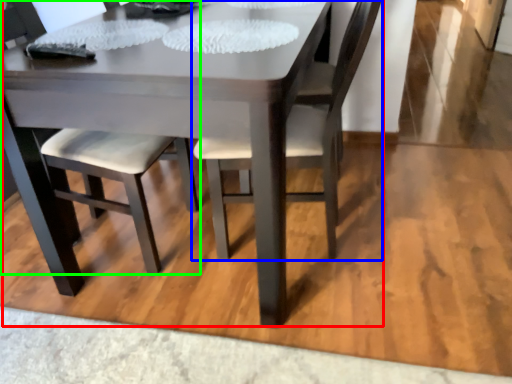
Question: Considering the real-world distances, which object is closest to kitchen & dining room table (highlighted by a red box)? chair (highlighted by a blue box) or chair (highlighted by a green box).

Choices:
 (A) chair
 (B) chair

Answer: (B)